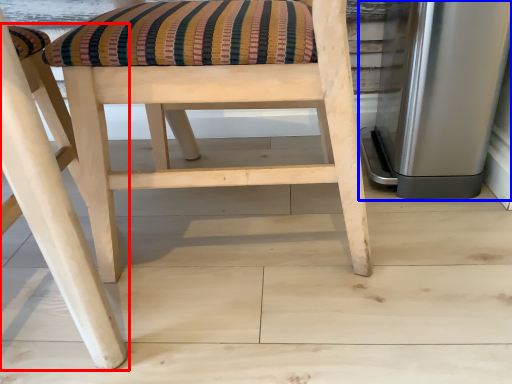
Question: Which point is closer to the camera, chair (highlighted by a red box) or appliance (highlighted by a blue box)?

Choices:
 (A) chair
 (B) appliance

Answer: (A)